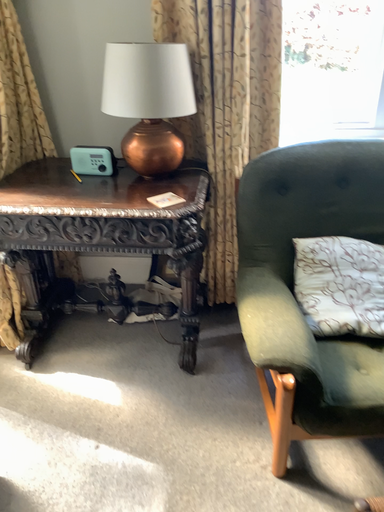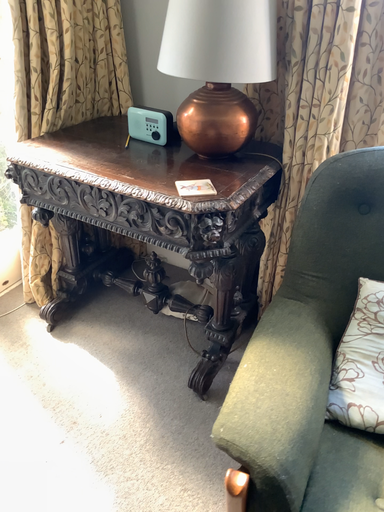
Question: How did the camera likely rotate when shooting the video?

Choices:
 (A) rotated left
 (B) rotated right

Answer: (A)